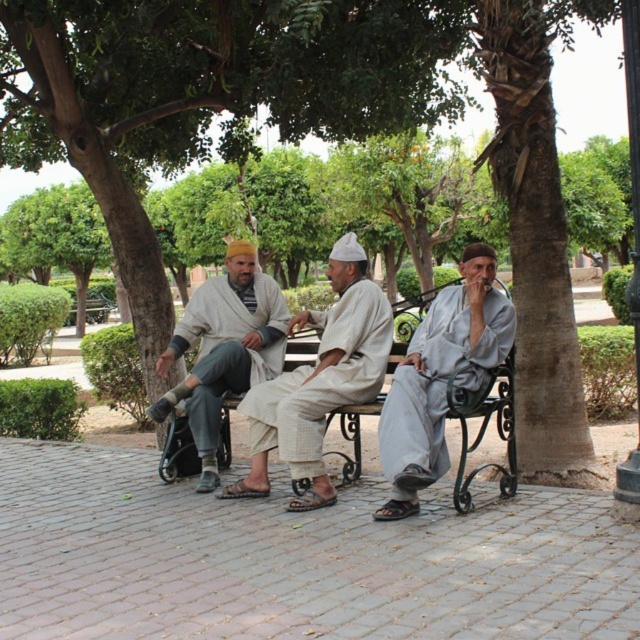
Based on the photo, based on the scene description, where is the light beige fabric robe at center located in terms of its 2D coordinates?

The light beige fabric robe at center is located at the 2D coordinates of point (320, 381).